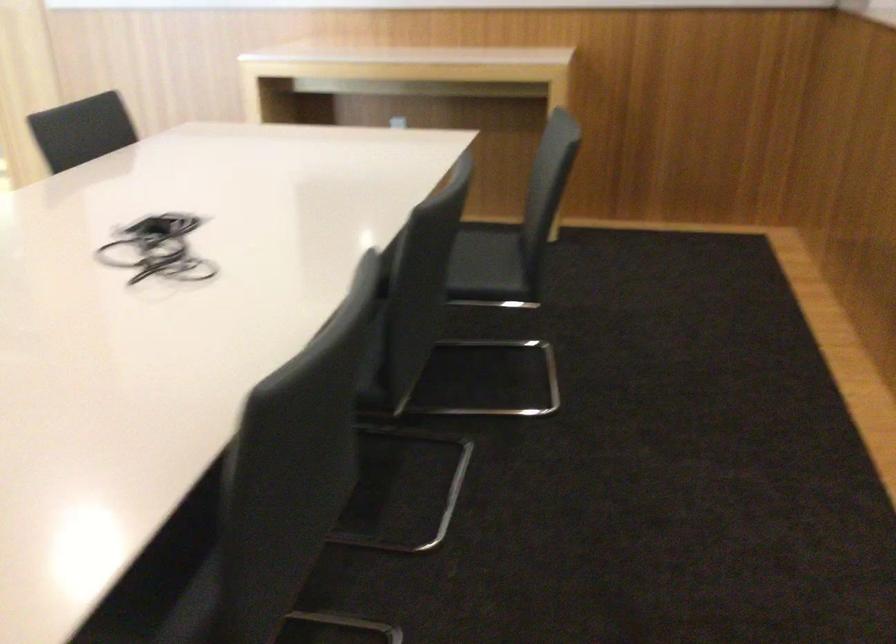
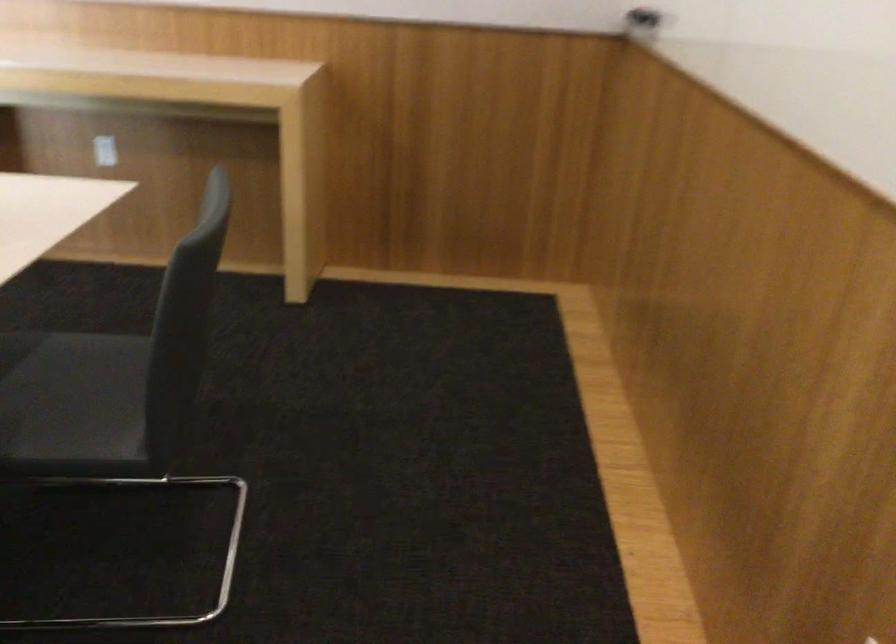
In a continuous first-person perspective shot, in which direction is the camera moving?

The movement direction of the cameraman is right, forward.